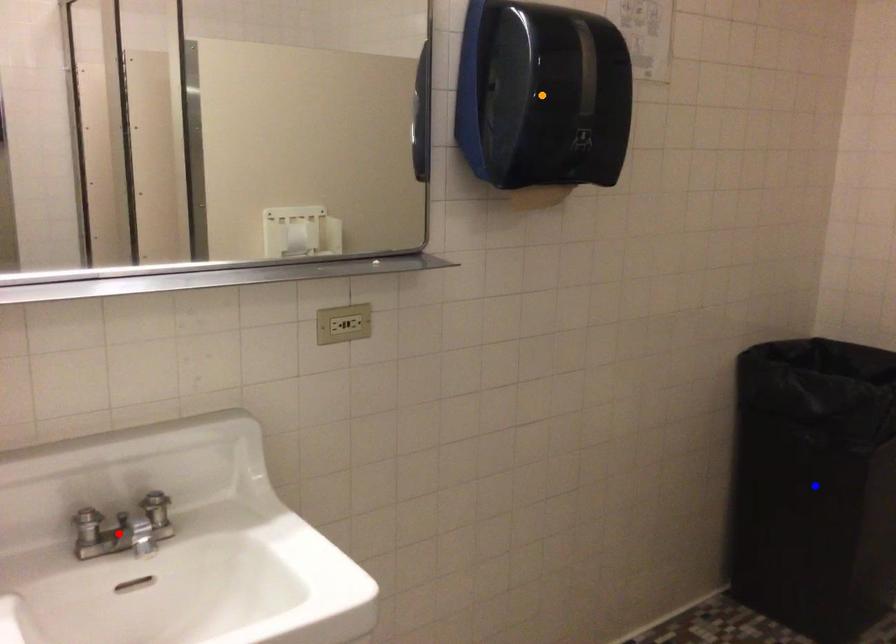
Order these from nearest to farthest:
- orange point
- blue point
- red point

1. blue point
2. orange point
3. red point